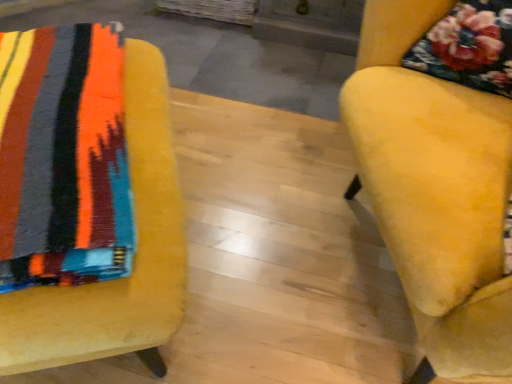
Find the location of a particular element. velvet yellow chair at left, which is the second chair in right-to-left order is located at coordinates (86, 200).

The height and width of the screenshot is (384, 512). Describe the element at coordinates (86, 200) in the screenshot. I see `velvet yellow chair at left, which ranks as the first chair in left-to-right order` at that location.

Measure the distance between point (399,106) and camera.

A: The distance of point (399,106) from camera is 32.09 inches.

This screenshot has height=384, width=512. What are the coordinates of `velvet yellow chair at right, the second chair when ordered from left to right` in the screenshot? It's located at (441, 171).

What is the approximate height of velvet yellow chair at right, the second chair when ordered from left to right?

25.15 inches.

The width and height of the screenshot is (512, 384). Describe the element at coordinates (441, 171) in the screenshot. I see `velvet yellow chair at right, which is the 1th chair in right-to-left order` at that location.

Find the location of a particular element. velvet yellow chair at left, which ranks as the first chair in left-to-right order is located at coordinates (86, 200).

Would you say velvet yellow chair at left, which is the second chair in right-to-left order, is to the left or to the right of velvet yellow chair at right, which is the 1th chair in right-to-left order, in the picture?

In the image, velvet yellow chair at left, which is the second chair in right-to-left order, appears on the left side of velvet yellow chair at right, which is the 1th chair in right-to-left order.

Is velvet yellow chair at left, which ranks as the first chair in left-to-right order, further to camera compared to velvet yellow chair at right, the second chair when ordered from left to right?

Yes.

Considering the points (163, 254) and (499, 87), which point is behind, point (163, 254) or point (499, 87)?

The point (499, 87) is farther.

From the image's perspective, relative to velvet yellow chair at right, the second chair when ordered from left to right, is velvet yellow chair at left, which is the second chair in right-to-left order, above or below?

From the image's perspective, velvet yellow chair at left, which is the second chair in right-to-left order, appears below velvet yellow chair at right, the second chair when ordered from left to right.

From a real-world perspective, is velvet yellow chair at left, which is the second chair in right-to-left order, positioned above or below velvet yellow chair at right, the second chair when ordered from left to right?

velvet yellow chair at left, which is the second chair in right-to-left order, is below velvet yellow chair at right, the second chair when ordered from left to right.

Considering the sizes of objects velvet yellow chair at left, which is the second chair in right-to-left order, and velvet yellow chair at right, the second chair when ordered from left to right, in the image provided, who is wider, velvet yellow chair at left, which is the second chair in right-to-left order, or velvet yellow chair at right, the second chair when ordered from left to right,?

velvet yellow chair at left, which is the second chair in right-to-left order, is wider.

Considering the sizes of objects velvet yellow chair at left, which is the second chair in right-to-left order, and velvet yellow chair at right, the second chair when ordered from left to right, in the image provided, who is taller, velvet yellow chair at left, which is the second chair in right-to-left order, or velvet yellow chair at right, the second chair when ordered from left to right,?

With more height is velvet yellow chair at right, the second chair when ordered from left to right.

Considering the sizes of objects velvet yellow chair at left, which is the second chair in right-to-left order, and velvet yellow chair at right, which is the 1th chair in right-to-left order, in the image provided, who is smaller, velvet yellow chair at left, which is the second chair in right-to-left order, or velvet yellow chair at right, which is the 1th chair in right-to-left order,?

Smaller between the two is velvet yellow chair at left, which is the second chair in right-to-left order.

Is velvet yellow chair at left, which is the second chair in right-to-left order, not within velvet yellow chair at right, which is the 1th chair in right-to-left order?

velvet yellow chair at left, which is the second chair in right-to-left order, is positioned outside velvet yellow chair at right, which is the 1th chair in right-to-left order.

Are velvet yellow chair at left, which is the second chair in right-to-left order, and velvet yellow chair at right, which is the 1th chair in right-to-left order, far apart?

They are positioned close to each other.

Is velvet yellow chair at left, which is the second chair in right-to-left order, facing towards velvet yellow chair at right, which is the 1th chair in right-to-left order?

No, velvet yellow chair at left, which is the second chair in right-to-left order, is not facing towards velvet yellow chair at right, which is the 1th chair in right-to-left order.

What's the angular difference between velvet yellow chair at left, which ranks as the first chair in left-to-right order, and velvet yellow chair at right, the second chair when ordered from left to right,'s facing directions?

The angular difference between velvet yellow chair at left, which ranks as the first chair in left-to-right order, and velvet yellow chair at right, the second chair when ordered from left to right, is 94.7 degrees.

The image size is (512, 384). Find the location of `chair to the left of velvet yellow chair at right, which is the 1th chair in right-to-left order`. chair to the left of velvet yellow chair at right, which is the 1th chair in right-to-left order is located at coordinates (86, 200).

Considering the positions of objects velvet yellow chair at right, the second chair when ordered from left to right, and velvet yellow chair at left, which is the second chair in right-to-left order, in the image provided, who is more to the left, velvet yellow chair at right, the second chair when ordered from left to right, or velvet yellow chair at left, which is the second chair in right-to-left order,?

Positioned to the left is velvet yellow chair at left, which is the second chair in right-to-left order.

Which object is more forward, velvet yellow chair at right, which is the 1th chair in right-to-left order, or velvet yellow chair at left, which ranks as the first chair in left-to-right order?

velvet yellow chair at right, which is the 1th chair in right-to-left order.

Between point (502, 304) and point (141, 185), which one is positioned in front?

The point (502, 304) is in front.

From the image's perspective, is velvet yellow chair at right, which is the 1th chair in right-to-left order, located above velvet yellow chair at left, which ranks as the first chair in left-to-right order?

Yes, from the image's perspective, velvet yellow chair at right, which is the 1th chair in right-to-left order, is above velvet yellow chair at left, which ranks as the first chair in left-to-right order.

From a real-world perspective, between velvet yellow chair at right, the second chair when ordered from left to right, and velvet yellow chair at left, which ranks as the first chair in left-to-right order, who is vertically higher?

velvet yellow chair at right, the second chair when ordered from left to right, is physically above.

Which object is wider, velvet yellow chair at right, which is the 1th chair in right-to-left order, or velvet yellow chair at left, which is the second chair in right-to-left order?

velvet yellow chair at left, which is the second chair in right-to-left order, is wider.

Considering the sizes of objects velvet yellow chair at right, the second chair when ordered from left to right, and velvet yellow chair at left, which is the second chair in right-to-left order, in the image provided, who is shorter, velvet yellow chair at right, the second chair when ordered from left to right, or velvet yellow chair at left, which is the second chair in right-to-left order,?

With less height is velvet yellow chair at left, which is the second chair in right-to-left order.

Consider the image. Can you confirm if velvet yellow chair at right, the second chair when ordered from left to right, is smaller than velvet yellow chair at left, which is the second chair in right-to-left order?

Incorrect, velvet yellow chair at right, the second chair when ordered from left to right, is not smaller in size than velvet yellow chair at left, which is the second chair in right-to-left order.

Would you say velvet yellow chair at right, which is the 1th chair in right-to-left order, is outside velvet yellow chair at left, which ranks as the first chair in left-to-right order?

velvet yellow chair at right, which is the 1th chair in right-to-left order, is positioned outside velvet yellow chair at left, which ranks as the first chair in left-to-right order.

Is the surface of velvet yellow chair at right, which is the 1th chair in right-to-left order, in direct contact with velvet yellow chair at left, which ranks as the first chair in left-to-right order?

No, velvet yellow chair at right, which is the 1th chair in right-to-left order, is not next to velvet yellow chair at left, which ranks as the first chair in left-to-right order.

Is velvet yellow chair at right, which is the 1th chair in right-to-left order, facing towards velvet yellow chair at left, which is the second chair in right-to-left order?

Yes, velvet yellow chair at right, which is the 1th chair in right-to-left order, is oriented towards velvet yellow chair at left, which is the second chair in right-to-left order.

How different are the orientations of velvet yellow chair at right, the second chair when ordered from left to right, and velvet yellow chair at left, which is the second chair in right-to-left order, in degrees?

The facing directions of velvet yellow chair at right, the second chair when ordered from left to right, and velvet yellow chair at left, which is the second chair in right-to-left order, are 94.7 degrees apart.

Measure the distance from velvet yellow chair at right, the second chair when ordered from left to right, to velvet yellow chair at left, which ranks as the first chair in left-to-right order.

They are 18.75 inches apart.

Find the location of a particular element. The width and height of the screenshot is (512, 384). chair below the velvet yellow chair at right, the second chair when ordered from left to right (from the image's perspective) is located at coordinates (86, 200).

Locate an element on the screen. chair in front of the velvet yellow chair at left, which is the second chair in right-to-left order is located at coordinates (441, 171).

This screenshot has height=384, width=512. What are the coordinates of `chair that is below the velvet yellow chair at right, the second chair when ordered from left to right (from the image's perspective)` in the screenshot? It's located at pos(86,200).